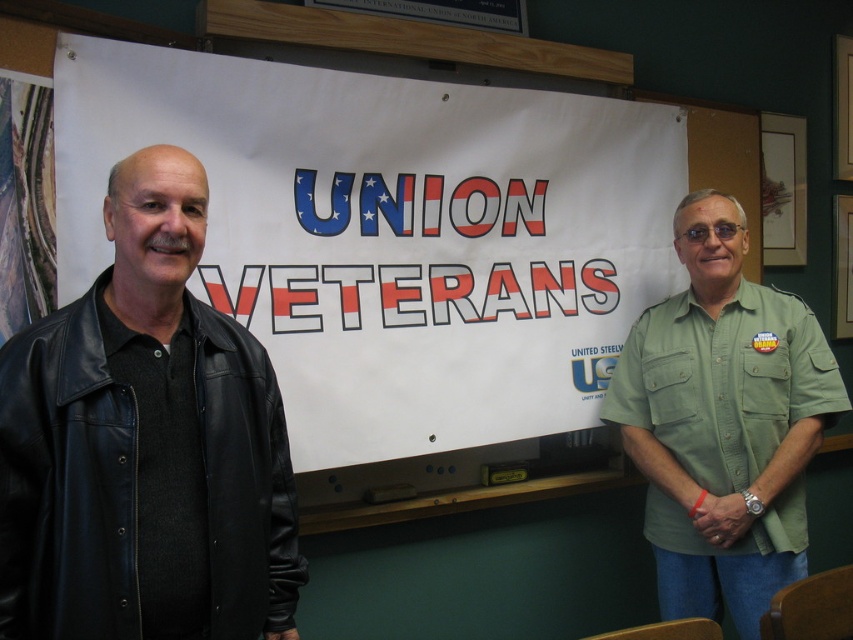
You are organizing a community event and have a white paper at center and a black leather jacket at left. Which object is closer to the front of the scene?

The white paper at center is closer to the front of the scene because the black leather jacket at left is behind it.